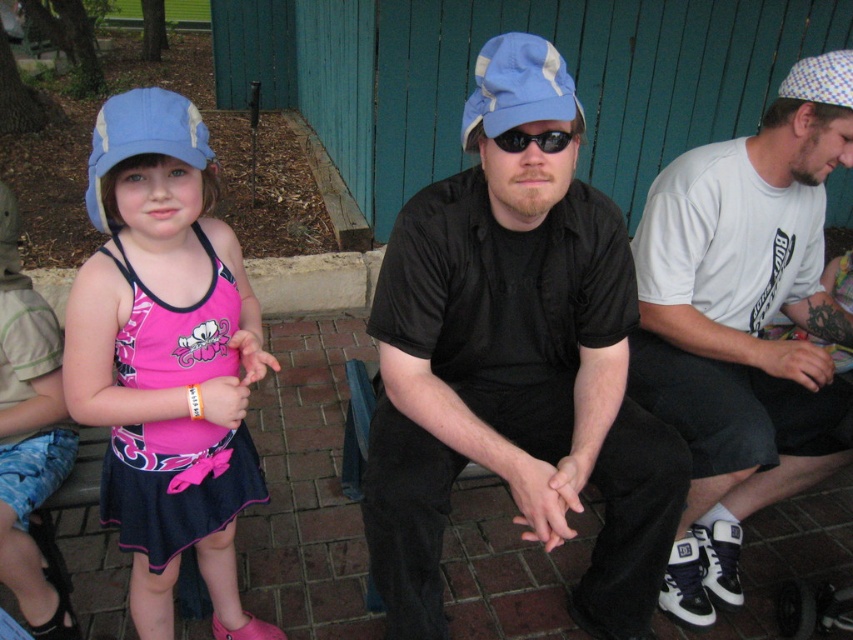
Is matte pink swimsuit at left above light blue fabric baseball cap at center?

Actually, matte pink swimsuit at left is below light blue fabric baseball cap at center.

The height and width of the screenshot is (640, 853). What are the coordinates of `matte pink swimsuit at left` in the screenshot? It's located at (166, 356).

Is pink fabric dress at left further to camera compared to black plastic sunglasses at center?

Yes, it is behind black plastic sunglasses at center.

Identify the location of pink fabric dress at left. (177, 483).

Is point (167, 552) positioned in front of point (498, 134)?

No, it is behind (498, 134).

I want to click on pink fabric dress at left, so click(x=177, y=483).

Can you confirm if white cotton t-shirt at right is smaller than black plastic sunglasses at center?

Incorrect, white cotton t-shirt at right is not smaller in size than black plastic sunglasses at center.

Who is lower down, white cotton t-shirt at right or black plastic sunglasses at center?

white cotton t-shirt at right

Is point (788, 352) closer to viewer compared to point (506, 145)?

No, it is behind (506, 145).

Find the location of a particular element. This screenshot has width=853, height=640. white cotton t-shirt at right is located at coordinates (743, 324).